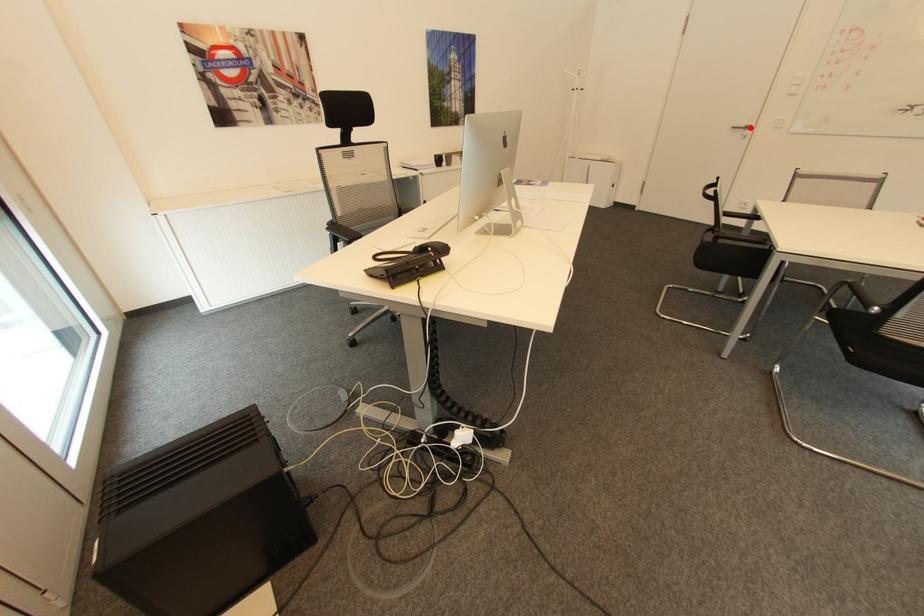
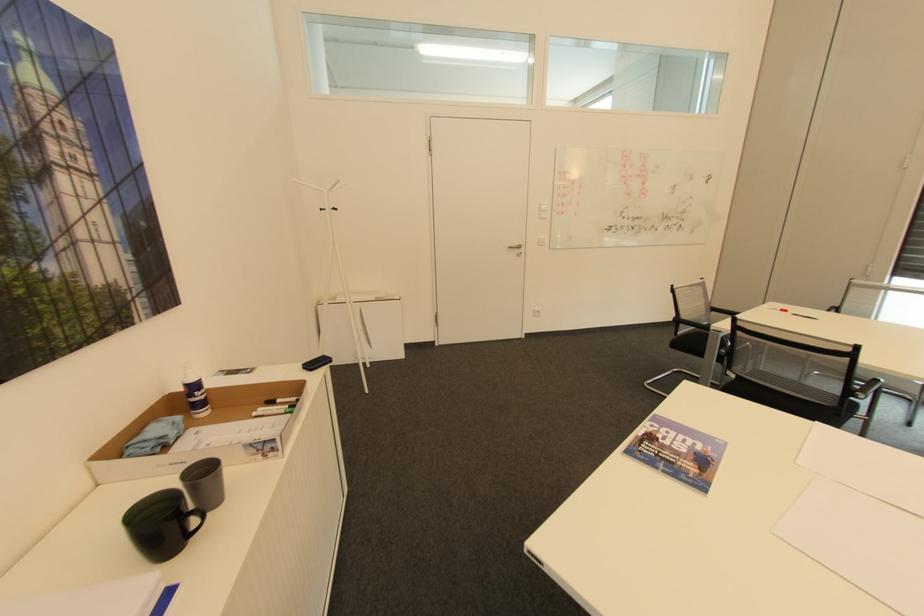
Question: A red point is marked in image1. In image2, is the corresponding 3D point closer to the camera or farther? Reply with the corresponding letter.

Choices:
 (A) The corresponding 3D point is closer.
 (B) The corresponding 3D point is farther.

Answer: (A)